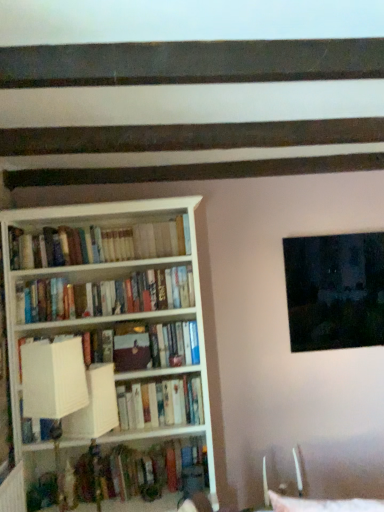
Question: Is hardcover books at center, the second book from the top, positioned with its back to dark matte painting at upper right?

Choices:
 (A) yes
 (B) no

Answer: (B)

Question: Is hardcover books at center, the second book from the top, completely or partially outside of dark matte painting at upper right?

Choices:
 (A) no
 (B) yes

Answer: (B)

Question: Is hardcover books at center, the second book from the top, wider than dark matte painting at upper right?

Choices:
 (A) yes
 (B) no

Answer: (A)

Question: Does hardcover books at center, the second book from the top, have a greater height compared to dark matte painting at upper right?

Choices:
 (A) no
 (B) yes

Answer: (A)

Question: Considering the relative sizes of hardcover books at center, the second book from the top, and dark matte painting at upper right in the image provided, is hardcover books at center, the second book from the top, shorter than dark matte painting at upper right?

Choices:
 (A) yes
 (B) no

Answer: (A)

Question: Based on their sizes in the image, would you say matte brown book at center is bigger or smaller than hardcover books at center, the second book from the top?

Choices:
 (A) big
 (B) small

Answer: (B)

Question: Is matte brown book at center in front of or behind hardcover books at center, the second book from the top, in the image?

Choices:
 (A) behind
 (B) front

Answer: (A)

Question: Is point (112, 357) closer or farther from the camera than point (117, 307)?

Choices:
 (A) farther
 (B) closer

Answer: (B)

Question: Looking at their shapes, would you say matte brown book at center is wider or thinner than hardcover books at center, the second book from the top?

Choices:
 (A) thin
 (B) wide

Answer: (A)

Question: Would you say metallic silver swivel chair at lower right is to the left or to the right of hardcover books at center, the second book from the top, in the picture?

Choices:
 (A) left
 (B) right

Answer: (B)

Question: From a real-world perspective, is metallic silver swivel chair at lower right physically located above or below hardcover books at center, which ranks as the third book in bottom-to-top order?

Choices:
 (A) below
 (B) above

Answer: (A)

Question: From the image's perspective, is metallic silver swivel chair at lower right above or below hardcover books at center, which ranks as the third book in bottom-to-top order?

Choices:
 (A) above
 (B) below

Answer: (B)

Question: Is metallic silver swivel chair at lower right wider or thinner than hardcover books at center, which ranks as the third book in bottom-to-top order?

Choices:
 (A) thin
 (B) wide

Answer: (B)

Question: Visually, is white fabric lampshade at left positioned to the left or to the right of hardcover books at center, the second book from the top?

Choices:
 (A) left
 (B) right

Answer: (B)

Question: From the image's perspective, is white fabric lampshade at left located above or below hardcover books at center, the second book from the top?

Choices:
 (A) below
 (B) above

Answer: (A)